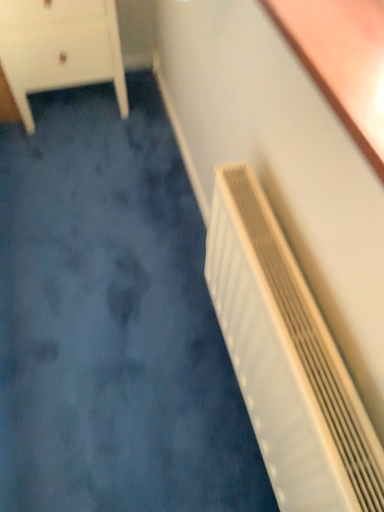
Question: From a real-world perspective, is white matte chest of drawers at upper left positioned over white plastic radiator at right based on gravity?

Choices:
 (A) no
 (B) yes

Answer: (A)

Question: Is white plastic radiator at right at the back of white matte chest of drawers at upper left?

Choices:
 (A) yes
 (B) no

Answer: (B)

Question: Does white matte chest of drawers at upper left have a lesser width compared to white plastic radiator at right?

Choices:
 (A) no
 (B) yes

Answer: (A)

Question: Is white matte chest of drawers at upper left smaller than white plastic radiator at right?

Choices:
 (A) no
 (B) yes

Answer: (A)

Question: Is white matte chest of drawers at upper left bigger than white plastic radiator at right?

Choices:
 (A) no
 (B) yes

Answer: (B)

Question: Is white matte chest of drawers at upper left not inside white plastic radiator at right?

Choices:
 (A) yes
 (B) no

Answer: (A)

Question: Can you confirm if white plastic radiator at right is taller than white matte chest of drawers at upper left?

Choices:
 (A) no
 (B) yes

Answer: (B)

Question: Is white plastic radiator at right wider than white matte chest of drawers at upper left?

Choices:
 (A) yes
 (B) no

Answer: (B)

Question: Would you say white plastic radiator at right is outside white matte chest of drawers at upper left?

Choices:
 (A) no
 (B) yes

Answer: (B)

Question: From the image's perspective, is white plastic radiator at right on white matte chest of drawers at upper left?

Choices:
 (A) no
 (B) yes

Answer: (A)

Question: From a real-world perspective, does white plastic radiator at right sit lower than white matte chest of drawers at upper left?

Choices:
 (A) no
 (B) yes

Answer: (A)

Question: Does white plastic radiator at right have a lesser height compared to white matte chest of drawers at upper left?

Choices:
 (A) no
 (B) yes

Answer: (A)

Question: Looking at their shapes, would you say white matte chest of drawers at upper left is wider or thinner than white plastic radiator at right?

Choices:
 (A) wide
 (B) thin

Answer: (A)